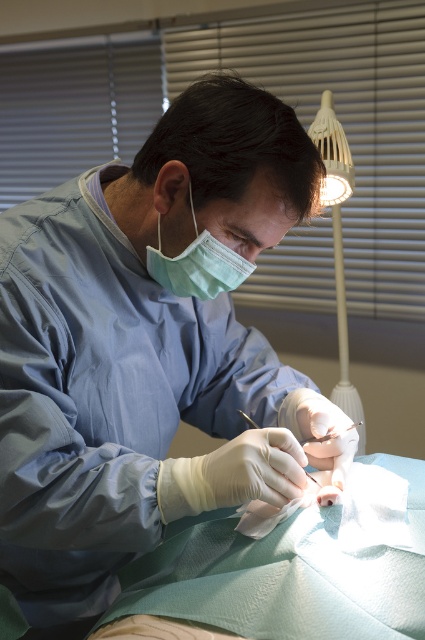
Question: Is matte blue gown at center smaller than green matte mask at center?

Choices:
 (A) no
 (B) yes

Answer: (A)

Question: Which point appears closest to the camera in this image?

Choices:
 (A) (337, 202)
 (B) (209, 266)
 (C) (88, 326)

Answer: (C)

Question: From the image, what is the correct spatial relationship of matte blue gown at center in relation to green matte mask at center?

Choices:
 (A) left
 (B) right

Answer: (A)

Question: Does white plastic lamp at upper right appear on the left side of green matte mask at center?

Choices:
 (A) no
 (B) yes

Answer: (A)

Question: Among these points, which one is farthest from the camera?

Choices:
 (A) (340, 144)
 (B) (226, 291)

Answer: (A)

Question: Among these points, which one is farthest from the camera?

Choices:
 (A) (337, 301)
 (B) (170, 272)

Answer: (A)